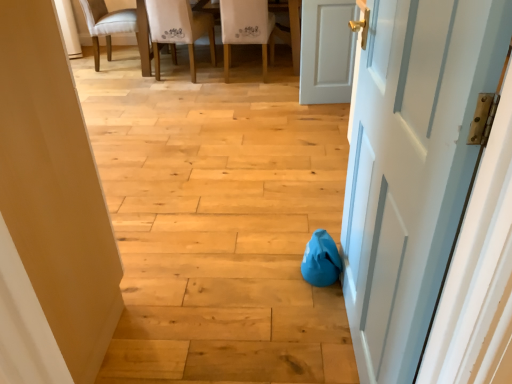
Find the location of a particular element. free space between white fabric chair at upper center, marked as the second chair in a right-to-left arrangement, and white painted wood door at right, arranged as the third door when viewed from the back is located at coordinates (238, 163).